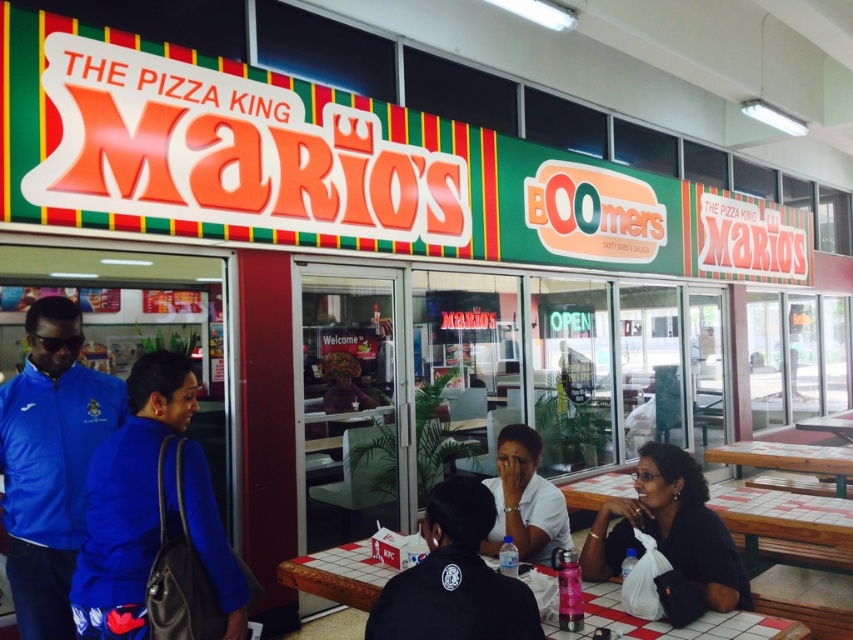
Can you confirm if blue fabric jacket at center is positioned to the right of black matte shirt at lower right?

No, blue fabric jacket at center is not to the right of black matte shirt at lower right.

Find the location of a particular element. Image resolution: width=853 pixels, height=640 pixels. blue fabric jacket at center is located at coordinates (131, 500).

Consider the image. Who is shorter, blue fabric jacket at center or checkered plastic table at lower center?

checkered plastic table at lower center

Can you confirm if blue fabric jacket at center is positioned to the left of checkered plastic table at lower center?

Correct, you'll find blue fabric jacket at center to the left of checkered plastic table at lower center.

Between point (117, 636) and point (769, 637), which one is positioned behind?

Positioned behind is point (117, 636).

Identify the location of blue fabric jacket at center. coord(131,500).

Is point (477, 600) closer to camera compared to point (610, 508)?

Yes, it is.

Does point (456, 577) lie behind point (640, 456)?

No, it is in front of (640, 456).

Where is `black uniform at center`? The width and height of the screenshot is (853, 640). black uniform at center is located at coordinates (454, 579).